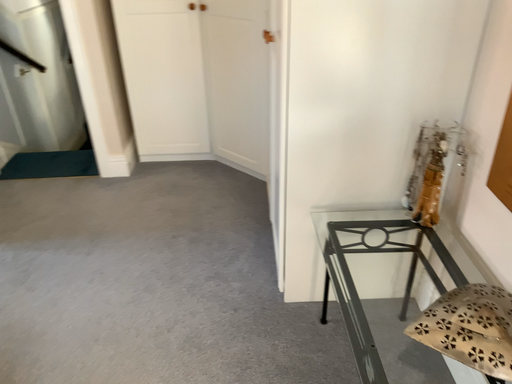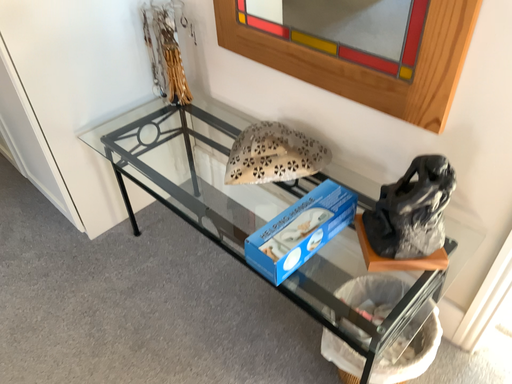
Question: How did the camera likely rotate when shooting the video?

Choices:
 (A) rotated right
 (B) rotated left

Answer: (A)